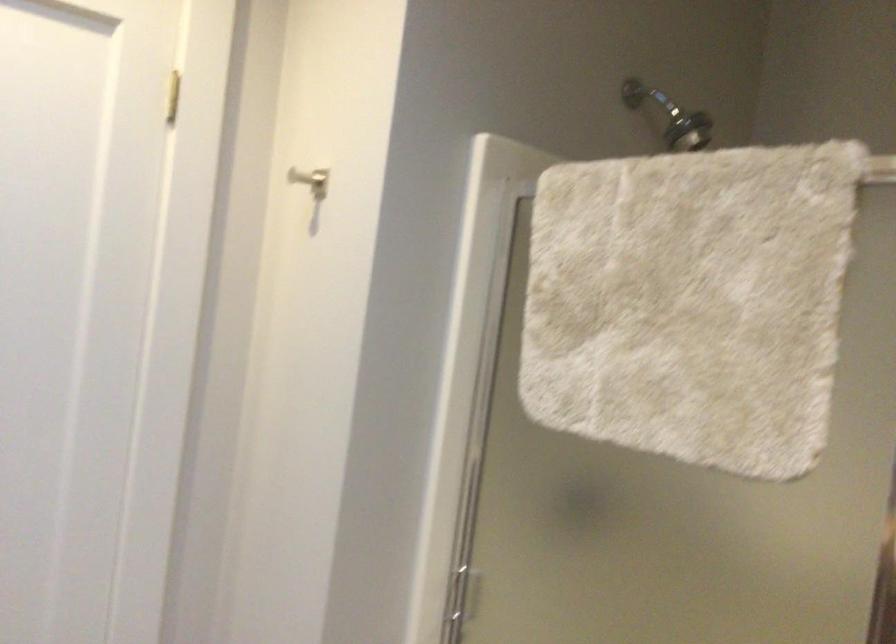
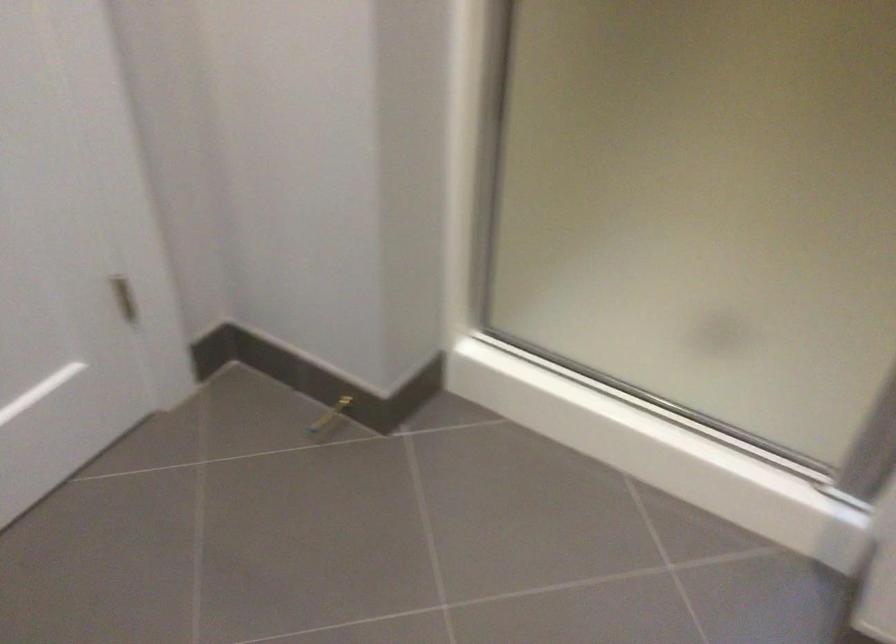
Question: Based on the continuous images, in which direction is the camera rotating? Reply with the corresponding letter.

Choices:
 (A) Left
 (B) Right
 (C) Up
 (D) Down

Answer: (D)